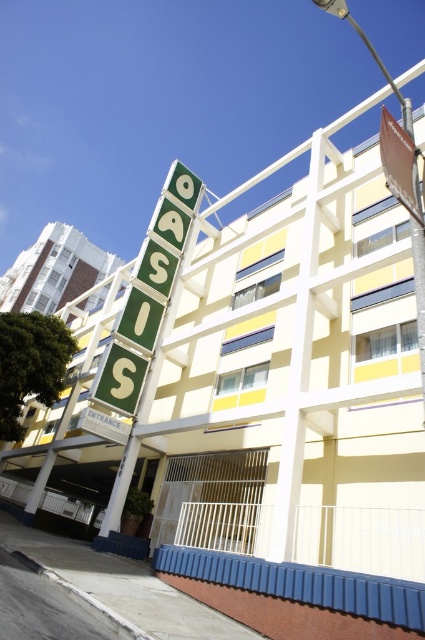
Is green matte sign at upper center bigger than brown paper sign at upper right?

Yes.

Who is more distant from viewer, (155, 264) or (407, 168)?

Positioned behind is point (155, 264).

Who is more forward, (127, 390) or (385, 152)?

Point (385, 152)

The image size is (425, 640). Identify the location of green matte sign at upper center. (147, 294).

Is white concrete building at upper left positioned in front of brown paper sign at upper right?

No.

Is white concrete building at upper left shorter than brown paper sign at upper right?

No.

Which is behind, point (74, 262) or point (388, 182)?

Point (74, 262)

Locate an element on the screen. The width and height of the screenshot is (425, 640). white concrete building at upper left is located at coordinates (53, 269).

Can you confirm if green matte sign at upper center is taller than white concrete building at upper left?

In fact, green matte sign at upper center may be shorter than white concrete building at upper left.

Is green matte sign at upper center positioned before white concrete building at upper left?

Yes, green matte sign at upper center is closer to the viewer.

Which is in front, point (181, 244) or point (65, 224)?

Point (181, 244)

This screenshot has height=640, width=425. Identify the location of green matte sign at upper center. (147, 294).